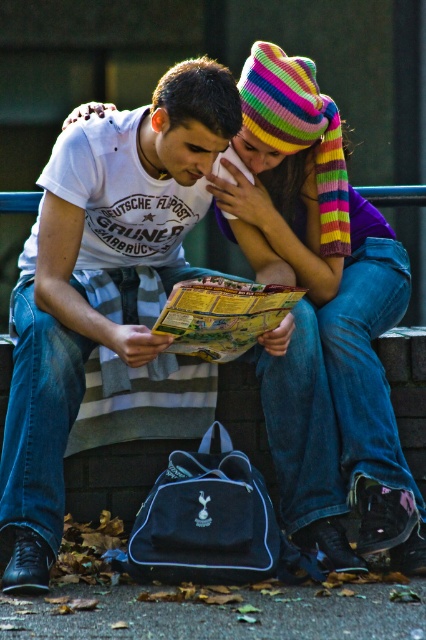
The width and height of the screenshot is (426, 640). Find the location of `knitted woolen hat at upper center`. knitted woolen hat at upper center is located at coordinates (331, 282).

Is point (307, 275) farther from camera compared to point (276, 314)?

Yes, point (307, 275) is behind point (276, 314).

This screenshot has width=426, height=640. I want to click on knitted woolen hat at upper center, so click(331, 282).

This screenshot has width=426, height=640. What are the coordinates of `knitted woolen hat at upper center` in the screenshot? It's located at 331,282.